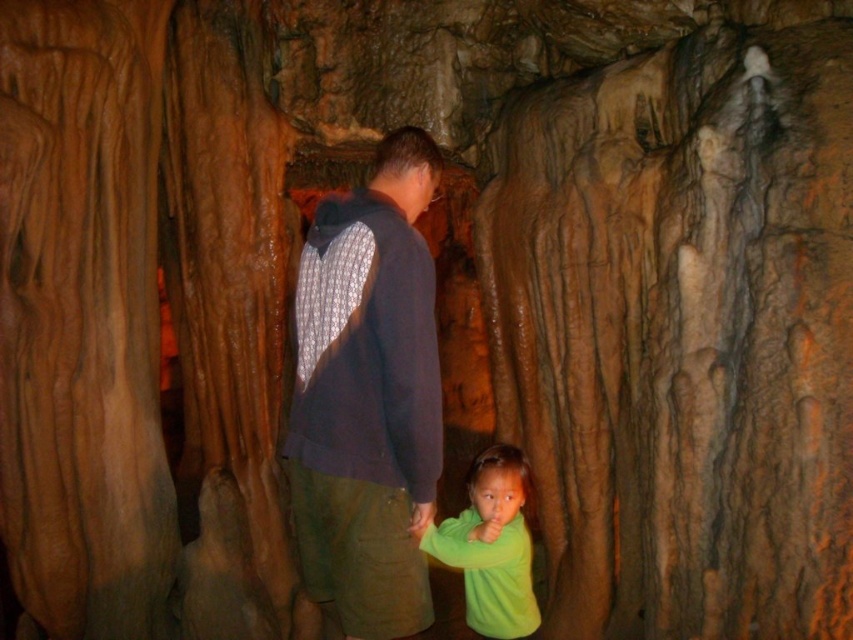
You are a photographer trying to capture a photo of both the dark blue hoodie at center and the green matte shirt at lower center in the same frame. Given that your camera has a minimum focus distance of 24 inches, will you be able to focus on both subjects clearly?

The dark blue hoodie at center and green matte shirt at lower center are 23.51 inches apart from each other, which is less than the camera minimum focus distance of 24 inches. Therefore, the camera cannot focus on both subjects clearly.

You are planning to take a photo of the two people in the cave scene. The adult is wearing a dark blue hoodie at center and the child is wearing a green matte shirt at lower center. Based on their clothing sizes, which one would you position closer to the camera to ensure both appear equally sized in the photo?

The dark blue hoodie at center is wider than the green matte shirt at lower center. To make them appear equally sized in the photo, position the child wearing the green matte shirt at lower center closer to the camera since it is narrower and needs to be magnified more to match the adult.